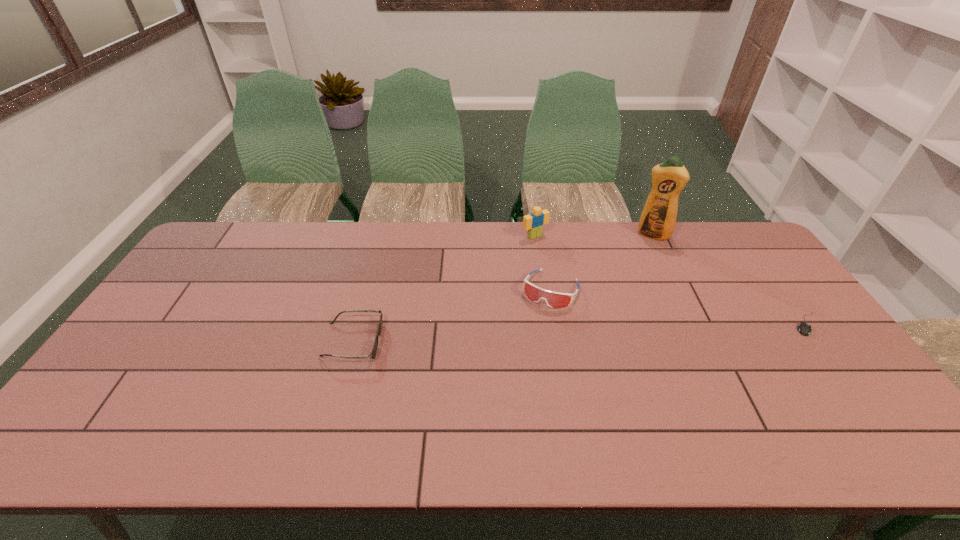
Find the location of a particular element. the leftmost object is located at coordinates (373, 354).

Locate an element on the screen. The image size is (960, 540). sunglasses is located at coordinates (373, 354).

Locate an element on the screen. This screenshot has height=540, width=960. mouse is located at coordinates (804, 328).

Image resolution: width=960 pixels, height=540 pixels. In order to click on the rightmost object in this screenshot , I will do `click(804, 328)`.

The width and height of the screenshot is (960, 540). I want to click on the fourth object from left to right, so click(x=658, y=218).

Where is `the tallest object`? the tallest object is located at coordinates point(658,218).

Find the location of `Lego`. Lego is located at coordinates (534, 222).

Find the location of a particular element. Image resolution: width=960 pixels, height=540 pixels. the third tallest object is located at coordinates (553, 299).

Locate an element on the screen. the third farthest object is located at coordinates (553, 299).

Find the location of a particular element. This screenshot has width=960, height=540. vacant area situated on the front-facing side of the sunglasses is located at coordinates (424, 341).